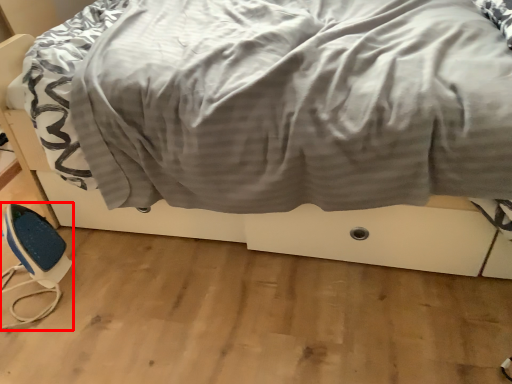
Question: Considering the relative positions of equipment (annotated by the red box) and bed in the image provided, where is equipment (annotated by the red box) located with respect to the staircase?

Choices:
 (A) right
 (B) left

Answer: (B)